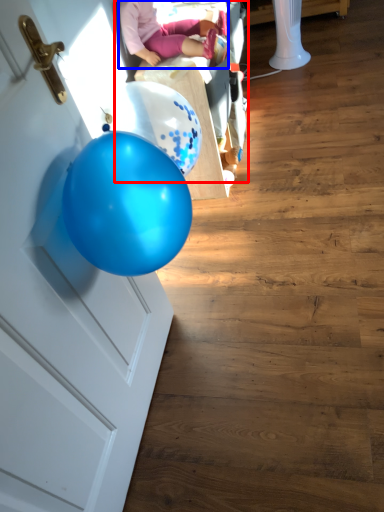
Question: Which object appears farthest to the camera in this image, baby carriage (highlighted by a red box) or person (highlighted by a blue box)?

Choices:
 (A) baby carriage
 (B) person

Answer: (A)